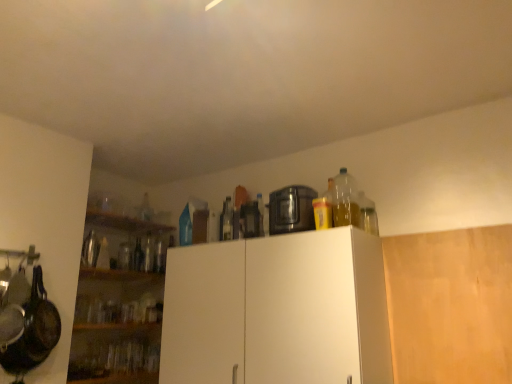
Question: Should I look upward or downward to see translucent plastic bottle at upper right, which is the fourth bottle in left-to-right order?

Choices:
 (A) down
 (B) up

Answer: (A)

Question: Is wooden cabinet at upper right, the first cabinetry positioned from the right, in front of black plastic food processor at upper center, acting as the first appliance starting from the right?

Choices:
 (A) yes
 (B) no

Answer: (A)

Question: Would you say wooden cabinet at upper right, the first cabinetry positioned from the right, is a long distance from black plastic food processor at upper center, acting as the first appliance starting from the right?

Choices:
 (A) no
 (B) yes

Answer: (A)

Question: Can you confirm if wooden cabinet at upper right, the first cabinetry positioned from the right, is smaller than black plastic food processor at upper center, which appears as the third appliance when viewed from the left?

Choices:
 (A) no
 (B) yes

Answer: (B)

Question: Can you confirm if wooden cabinet at upper right, which is counted as the second cabinetry, starting from the left, is bigger than black plastic food processor at upper center, acting as the first appliance starting from the right?

Choices:
 (A) no
 (B) yes

Answer: (A)

Question: Can you confirm if wooden cabinet at upper right, the first cabinetry positioned from the right, is positioned to the right of black plastic food processor at upper center, which appears as the third appliance when viewed from the left?

Choices:
 (A) no
 (B) yes

Answer: (B)

Question: From the image's perspective, does wooden cabinet at upper right, which is counted as the second cabinetry, starting from the left, appear lower than black plastic food processor at upper center, which appears as the third appliance when viewed from the left?

Choices:
 (A) no
 (B) yes

Answer: (B)

Question: Does white matte cabinet at upper center, which is the 1th cabinetry from left to right, lie in front of brushed metal thermos at left, the 1th appliance viewed from the left?

Choices:
 (A) yes
 (B) no

Answer: (A)

Question: Can you confirm if white matte cabinet at upper center, which is the 1th cabinetry from left to right, is smaller than brushed metal thermos at left, which is the 3th appliance from right to left?

Choices:
 (A) yes
 (B) no

Answer: (B)

Question: Considering the relative positions of white matte cabinet at upper center, which is counted as the 2th cabinetry, starting from the right, and brushed metal thermos at left, which is the 3th appliance from right to left, in the image provided, is white matte cabinet at upper center, which is counted as the 2th cabinetry, starting from the right, to the left of brushed metal thermos at left, which is the 3th appliance from right to left, from the viewer's perspective?

Choices:
 (A) no
 (B) yes

Answer: (A)

Question: From a real-world perspective, is white matte cabinet at upper center, which is counted as the 2th cabinetry, starting from the right, physically above brushed metal thermos at left, which is the 3th appliance from right to left?

Choices:
 (A) yes
 (B) no

Answer: (B)

Question: Does white matte cabinet at upper center, which is the 1th cabinetry from left to right, turn towards brushed metal thermos at left, the 1th appliance viewed from the left?

Choices:
 (A) no
 (B) yes

Answer: (A)

Question: Is white matte cabinet at upper center, which is counted as the 2th cabinetry, starting from the right, further to the viewer compared to brushed metal thermos at left, the 1th appliance viewed from the left?

Choices:
 (A) yes
 (B) no

Answer: (B)

Question: Can you confirm if translucent plastic bottle at upper right, the fourth bottle in the back-to-front sequence, is smaller than brushed metal thermos at left, the 1th appliance viewed from the left?

Choices:
 (A) no
 (B) yes

Answer: (A)